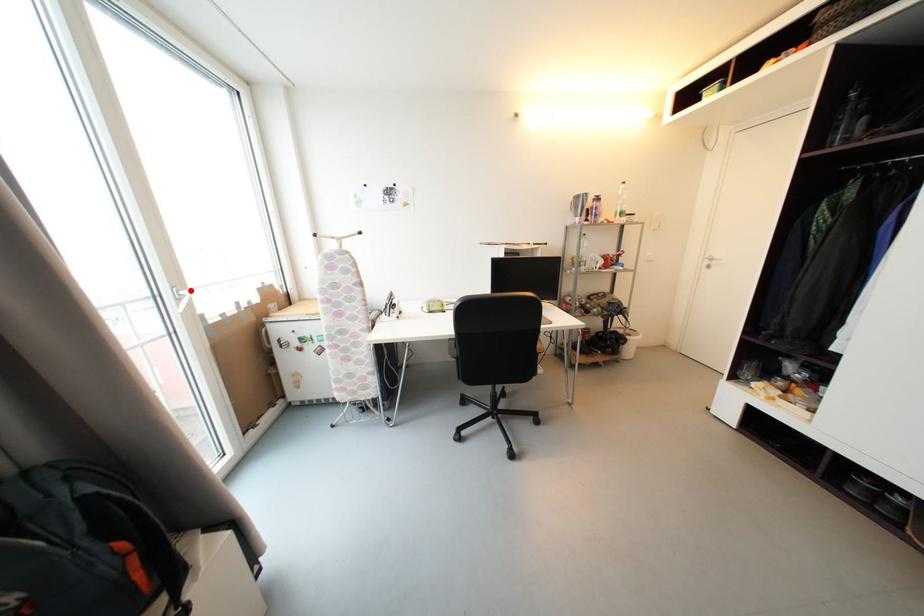
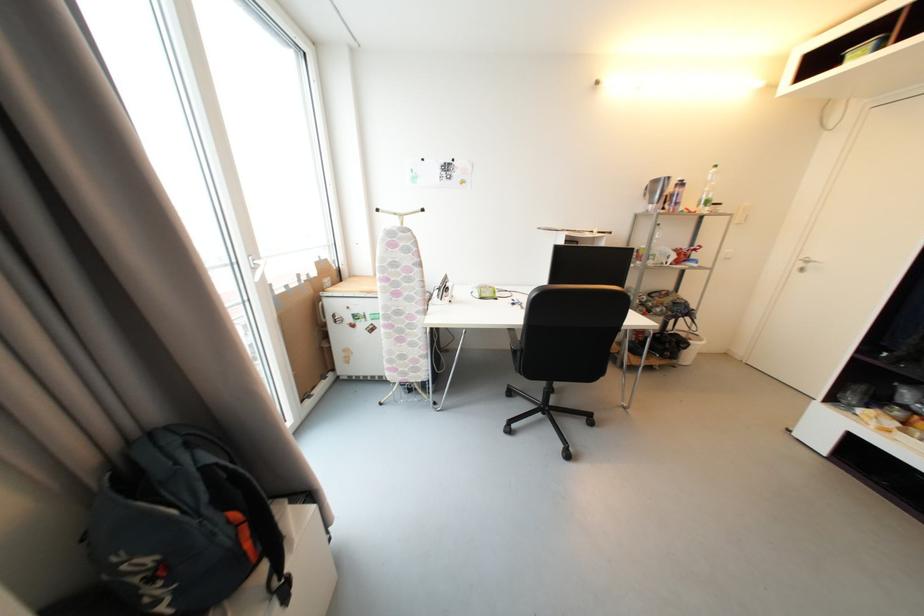
Question: I am providing you with two images of the same scene from different viewpoints. A red point is shown in image1. For the corresponding object point in image2, is it positioned nearer or farther from the camera?

Choices:
 (A) Nearer
 (B) Farther

Answer: (A)